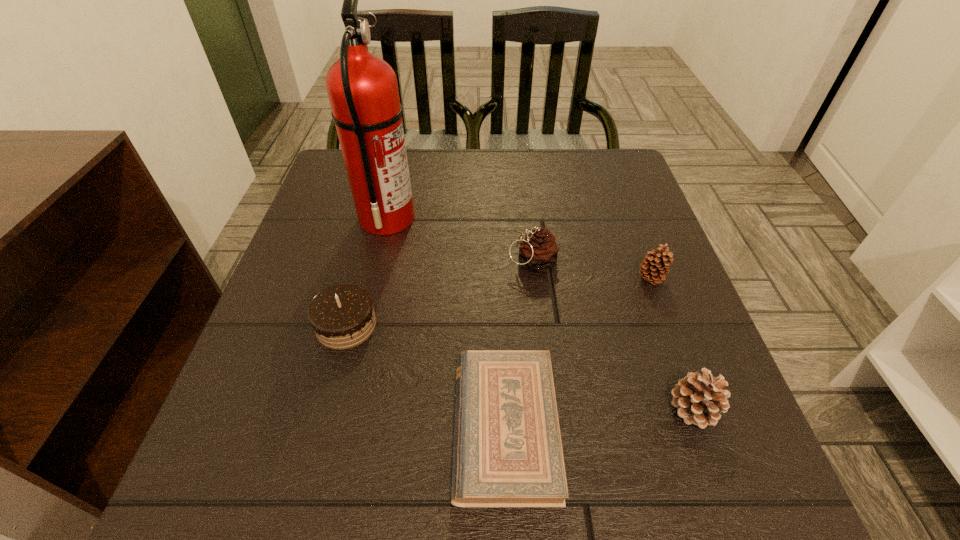
Locate an element on the screen. This screenshot has height=540, width=960. free spot located on the back of the nearest pinecone is located at coordinates (667, 337).

In order to click on free space located on the spine side of the shortest object in this screenshot , I will do `click(318, 427)`.

I want to click on vacant area located 0.260m on the spine side of the shortest object, so click(x=284, y=427).

Locate an element on the screen. This screenshot has width=960, height=540. free region located 0.290m on the spine side of the shortest object is located at coordinates (265, 427).

Find the location of a particular element. This screenshot has width=960, height=540. object present at the far edge is located at coordinates (362, 88).

This screenshot has width=960, height=540. I want to click on object that is at the near edge, so click(x=507, y=452).

In order to click on fire extinguisher that is at the left edge in this screenshot , I will do `click(362, 88)`.

Locate an element on the screen. chocolate cake that is positioned at the left edge is located at coordinates (342, 316).

Identify the location of object positioned at the far left corner. Image resolution: width=960 pixels, height=540 pixels. (362, 88).

Image resolution: width=960 pixels, height=540 pixels. Find the location of `vacant region at the far edge of the desktop`. vacant region at the far edge of the desktop is located at coordinates (509, 161).